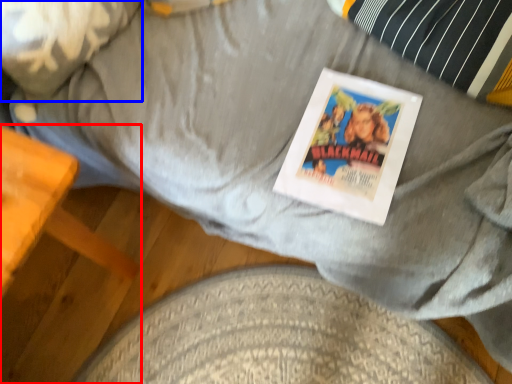
Question: Which of the following is the farthest to the observer, furniture (highlighted by a red box) or pillow (highlighted by a blue box)?

Choices:
 (A) furniture
 (B) pillow

Answer: (B)